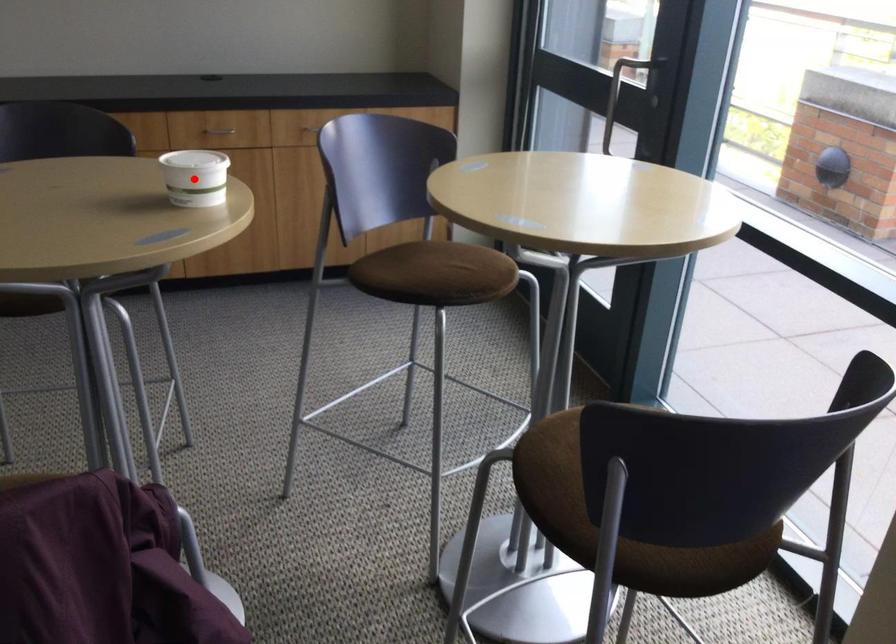
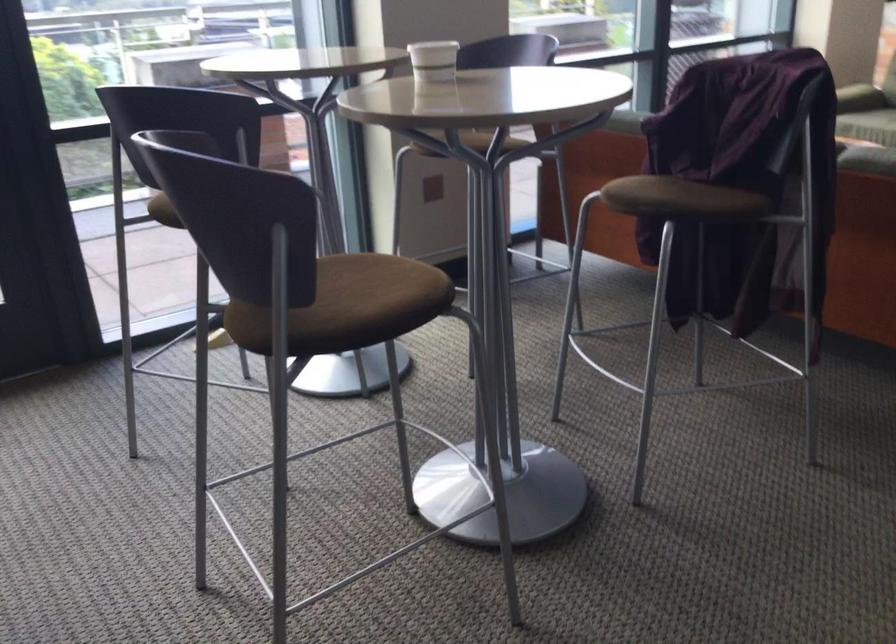
Locate, in the second image, the point that corresponds to the highlighted location in the first image.

(433, 61)